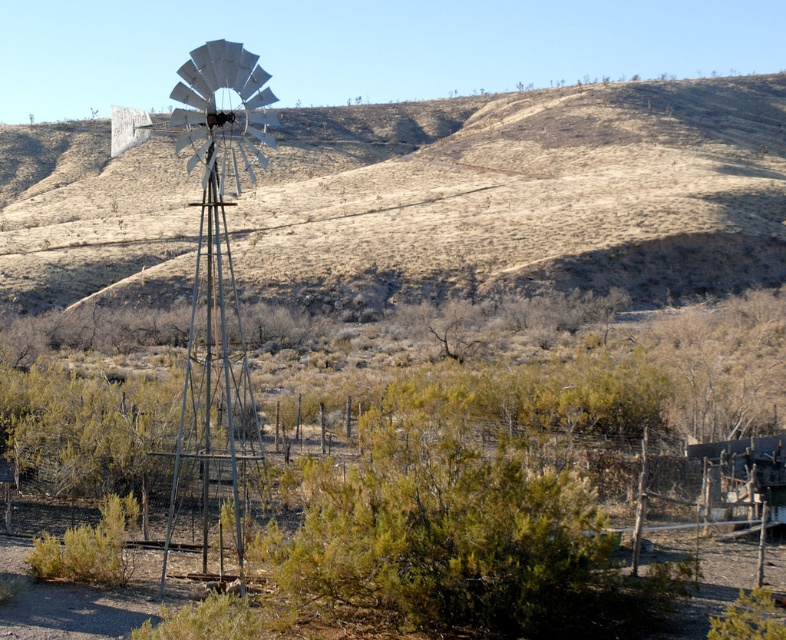
Which is below, brown grassy hillside at center or metallic windmill at center-left?

Positioned lower is metallic windmill at center-left.

Who is more forward, (643, 157) or (208, 288)?

Point (208, 288) is in front.

Identify the location of brown grassy hillside at center. (526, 192).